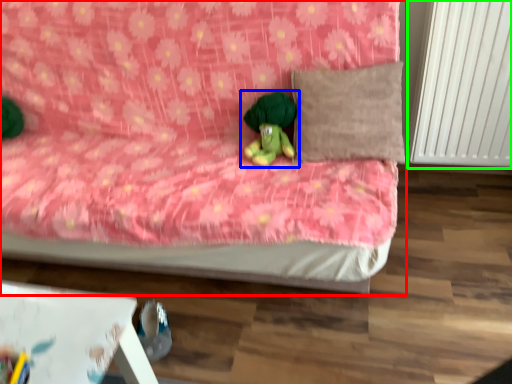
Question: Which is nearer to the bed (highlighted by a red box)? toy (highlighted by a blue box) or radiator (highlighted by a green box).

Choices:
 (A) toy
 (B) radiator

Answer: (A)